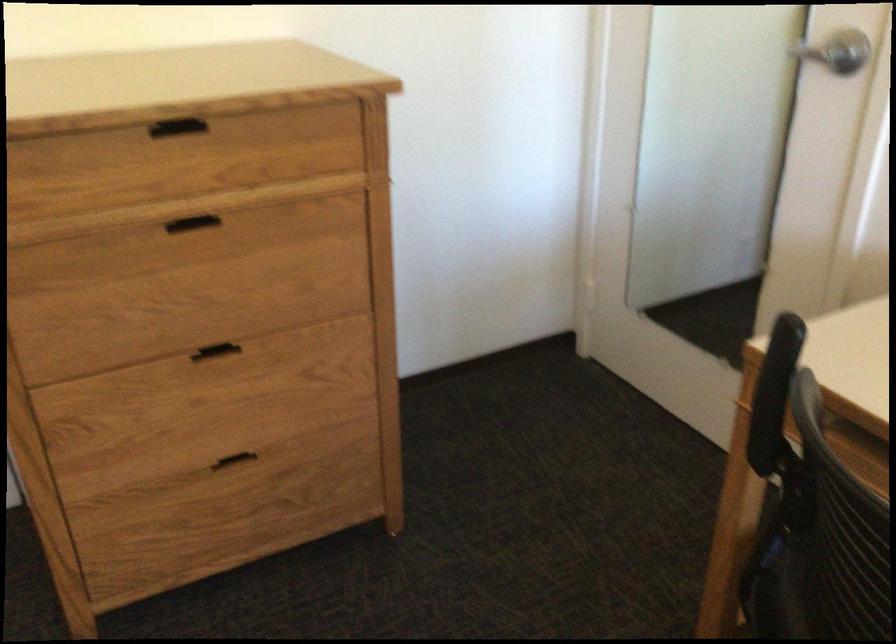
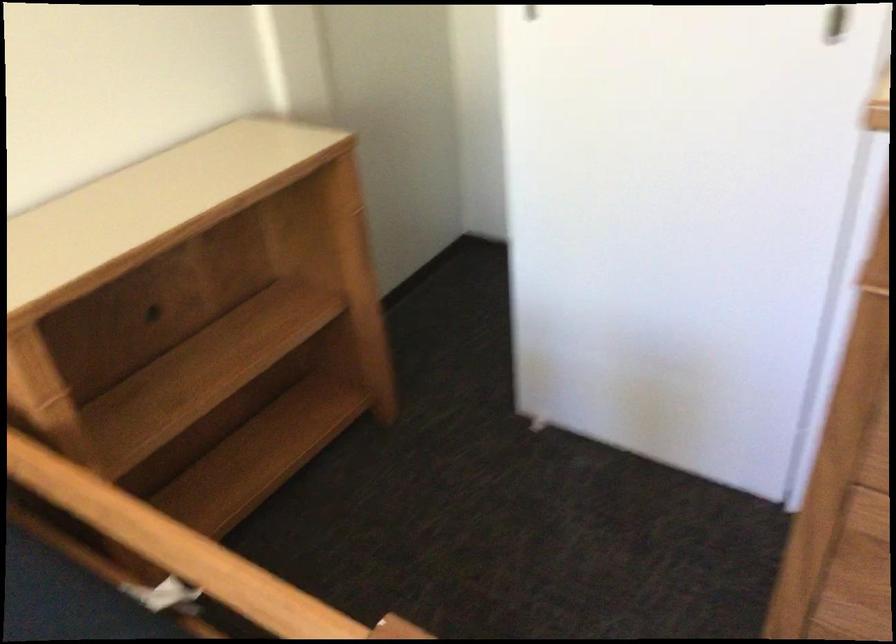
Based on the continuous images, in which direction is the camera rotating?

The rotation direction of the camera is left-down.